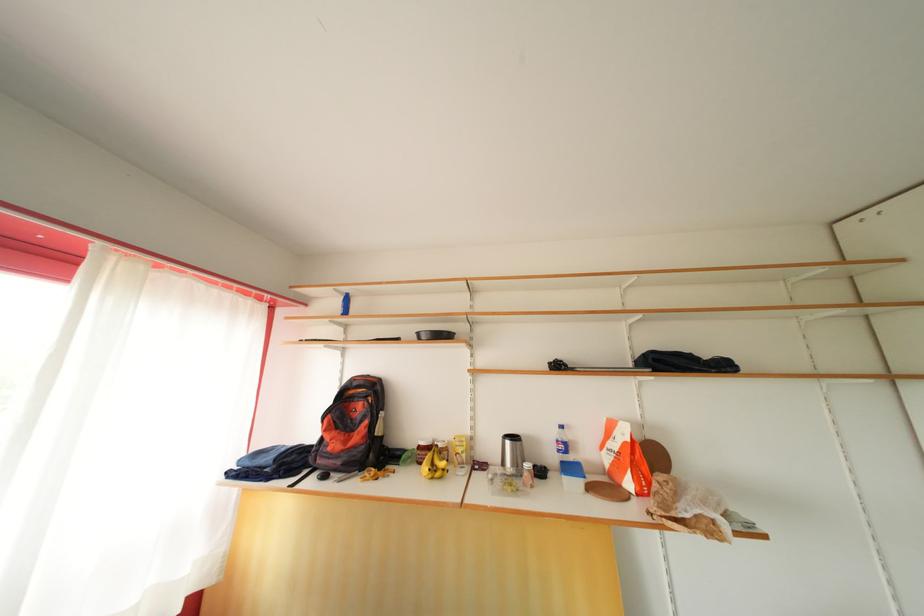
Which object does [562,444] point to?

This point indicates the plastic water bottle.